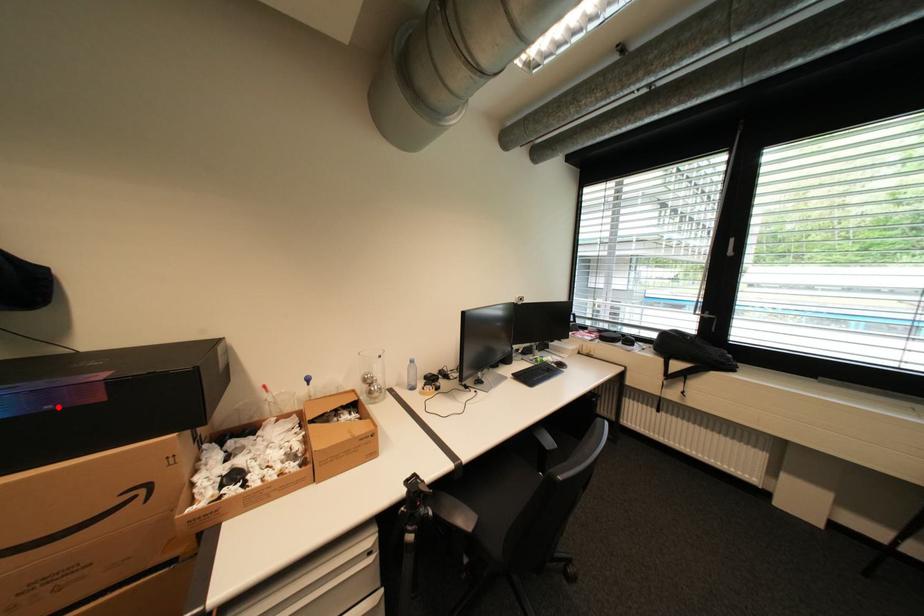
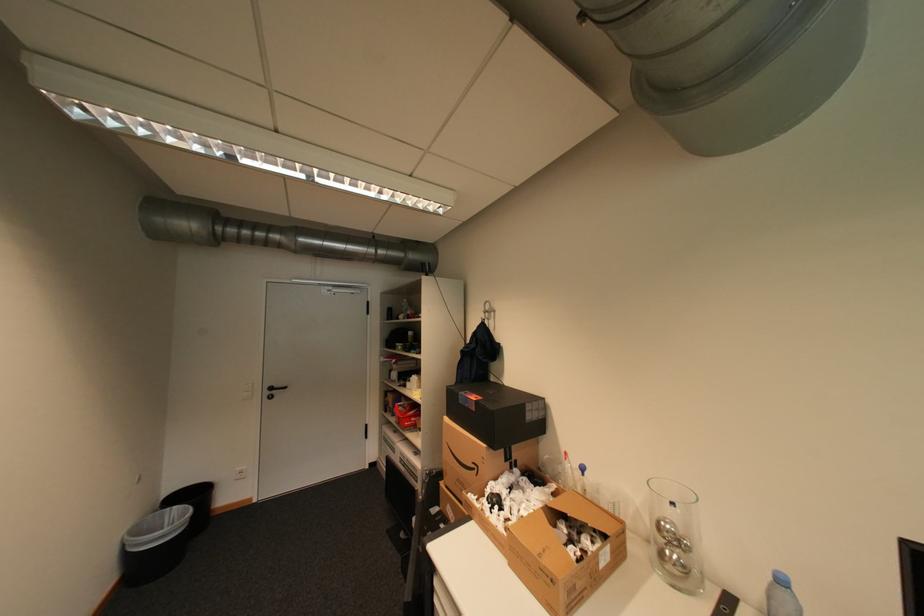
In the second image, find the point that corresponds to the highlighted location in the first image.

(476, 406)